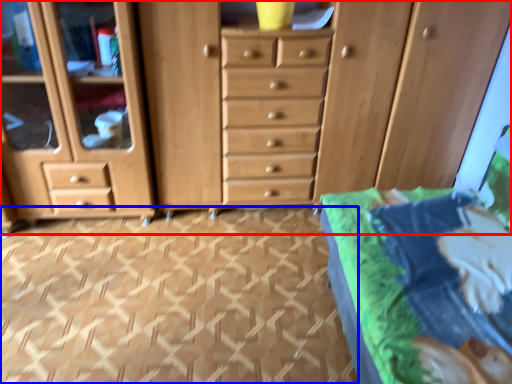
Question: Which object is further to the camera taking this photo, chest of drawers (highlighted by a red box) or tile (highlighted by a blue box)?

Choices:
 (A) chest of drawers
 (B) tile

Answer: (A)